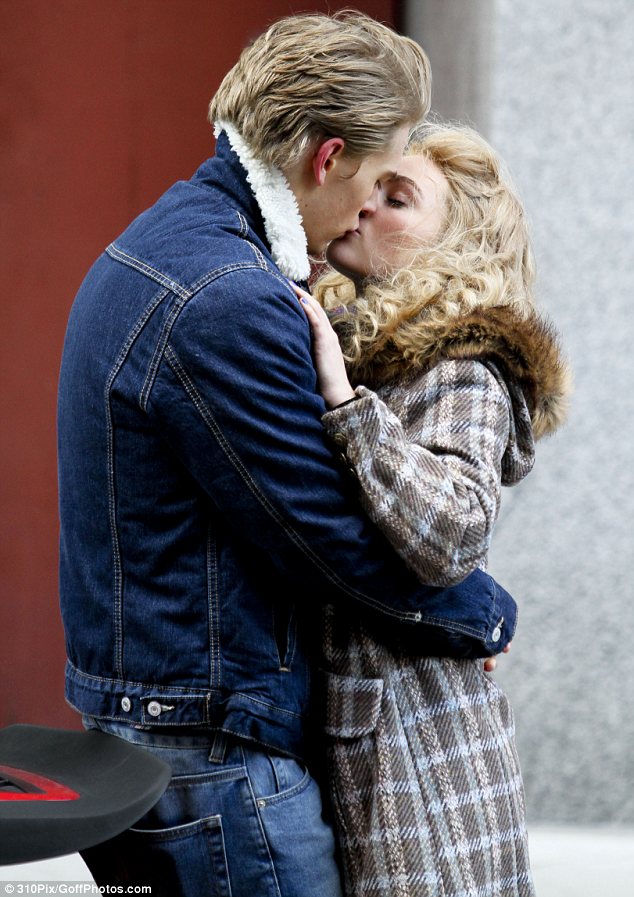
Locate an element on the screen. Image resolution: width=634 pixels, height=897 pixels. seat is located at coordinates (51, 798).